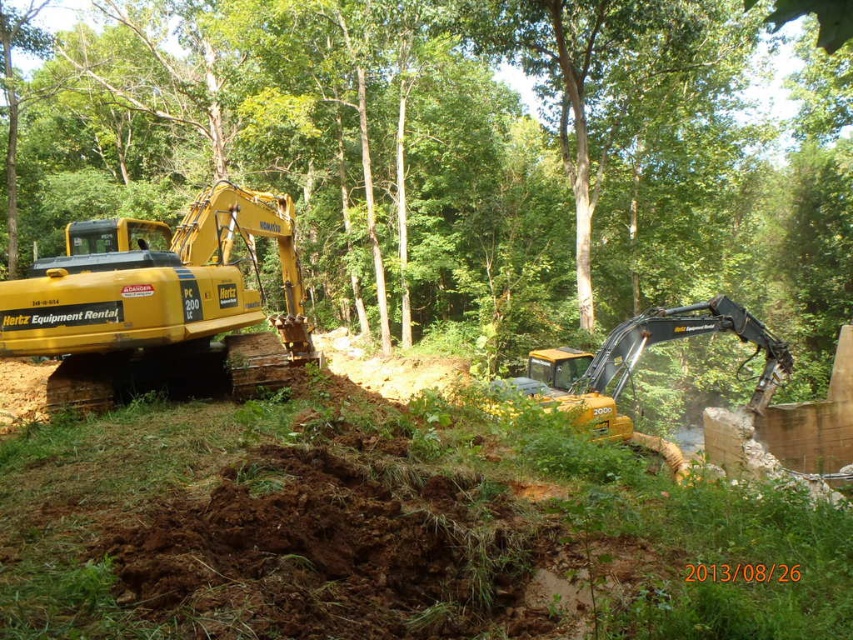
You are a safety inspector standing at the edge of a construction site. You notice a green leafy tree at upper center that might be in the path of the excavators. Can you confirm if the tree is within a 4 meter safety zone from your current position?

The green leafy tree at upper center is 3.76 meters from viewer, so it is within the 4 meter safety zone. The excavators must avoid damaging the tree.

You are a safety inspector assessing the construction site. You notice the yellow metallic excavator at left and the yellow rubber excavator at center. Which one has a higher center of gravity, potentially posing a greater risk of tipping over in uneven terrain?

The yellow metallic excavator at left has a higher center of gravity because it is taller than the yellow rubber excavator at center, making it more prone to tipping on uneven ground.